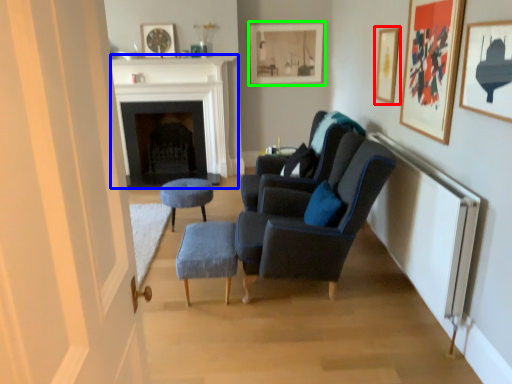
Question: Which object is the farthest from picture frame (highlighted by a red box)? Choose among these: fireplace (highlighted by a blue box) or picture frame (highlighted by a green box).

Choices:
 (A) fireplace
 (B) picture frame

Answer: (A)